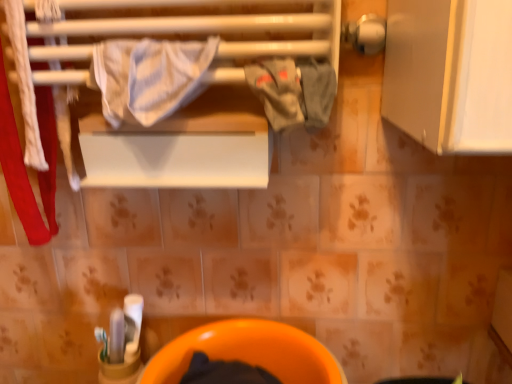
Question: Considering the relative positions of orange glossy toilet bowl at lower center and gray cotton cloth at center in the image provided, is orange glossy toilet bowl at lower center behind gray cotton cloth at center?

Choices:
 (A) no
 (B) yes

Answer: (B)

Question: Is orange glossy toilet bowl at lower center bigger than gray cotton cloth at center?

Choices:
 (A) no
 (B) yes

Answer: (B)

Question: Is orange glossy toilet bowl at lower center positioned beyond the bounds of gray cotton cloth at center?

Choices:
 (A) yes
 (B) no

Answer: (A)

Question: Is orange glossy toilet bowl at lower center positioned far away from gray cotton cloth at center?

Choices:
 (A) yes
 (B) no

Answer: (B)

Question: Can you confirm if orange glossy toilet bowl at lower center is shorter than gray cotton cloth at center?

Choices:
 (A) no
 (B) yes

Answer: (A)

Question: Is gray cotton cloth at center taller or shorter than white striped fabric at upper center?

Choices:
 (A) tall
 (B) short

Answer: (B)

Question: In the image, is gray cotton cloth at center positioned in front of or behind white striped fabric at upper center?

Choices:
 (A) front
 (B) behind

Answer: (B)

Question: Would you say gray cotton cloth at center is to the left or to the right of white striped fabric at upper center in the picture?

Choices:
 (A) right
 (B) left

Answer: (A)

Question: Looking at their shapes, would you say gray cotton cloth at center is wider or thinner than white striped fabric at upper center?

Choices:
 (A) wide
 (B) thin

Answer: (B)

Question: In the image, is gray cotton cloth at center positioned in front of or behind orange glossy toilet bowl at lower center?

Choices:
 (A) behind
 (B) front

Answer: (B)

Question: Is gray cotton cloth at center taller or shorter than orange glossy toilet bowl at lower center?

Choices:
 (A) tall
 (B) short

Answer: (B)

Question: Looking at their shapes, would you say gray cotton cloth at center is wider or thinner than orange glossy toilet bowl at lower center?

Choices:
 (A) wide
 (B) thin

Answer: (B)

Question: In terms of size, does gray cotton cloth at center appear bigger or smaller than orange glossy toilet bowl at lower center?

Choices:
 (A) small
 (B) big

Answer: (A)

Question: Relative to gray cotton cloth at center, is white striped fabric at upper center in front or behind?

Choices:
 (A) behind
 (B) front

Answer: (B)

Question: Considering the relative positions of white striped fabric at upper center and gray cotton cloth at center in the image provided, is white striped fabric at upper center to the left or to the right of gray cotton cloth at center?

Choices:
 (A) left
 (B) right

Answer: (A)